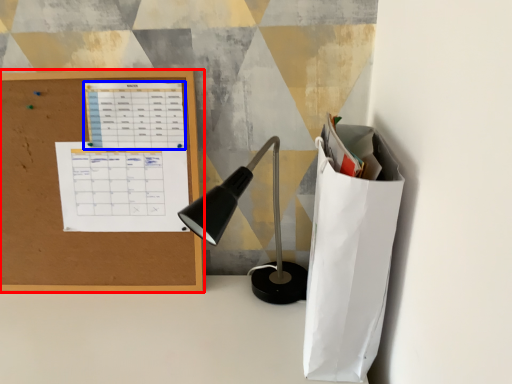
Question: Which object is further to the camera taking this photo, office supplies (highlighted by a red box) or notebook (highlighted by a blue box)?

Choices:
 (A) office supplies
 (B) notebook

Answer: (B)